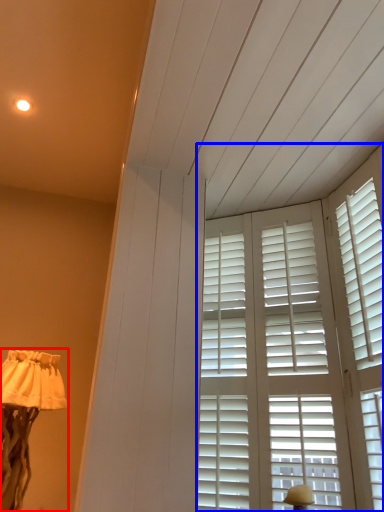
Question: Which object appears farthest to the camera in this image, lamp (highlighted by a red box) or window (highlighted by a blue box)?

Choices:
 (A) lamp
 (B) window

Answer: (A)